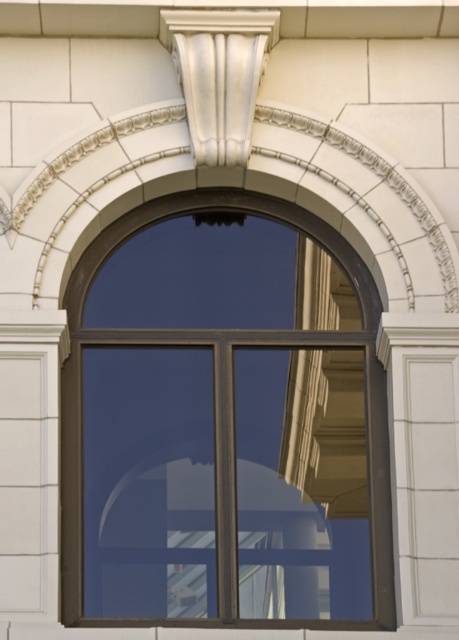
Question: From the image, what is the correct spatial relationship of matte black window frame at center in relation to glossy glass window at center?

Choices:
 (A) right
 (B) left

Answer: (A)

Question: Which is nearer to the glossy glass window at center?

Choices:
 (A) white glossy column at upper center
 (B) matte black window frame at center

Answer: (B)

Question: Is the position of matte black window frame at center less distant than that of white glossy column at upper center?

Choices:
 (A) no
 (B) yes

Answer: (B)

Question: Among these objects, which one is farthest from the camera?

Choices:
 (A) matte black window frame at center
 (B) white glossy column at upper center
 (C) glossy glass window at center

Answer: (B)

Question: Which object is closer to the camera taking this photo?

Choices:
 (A) matte black window frame at center
 (B) glossy glass window at center
 (C) white glossy column at upper center

Answer: (A)

Question: Can you confirm if matte black window frame at center is positioned above glossy glass window at center?

Choices:
 (A) yes
 (B) no

Answer: (A)